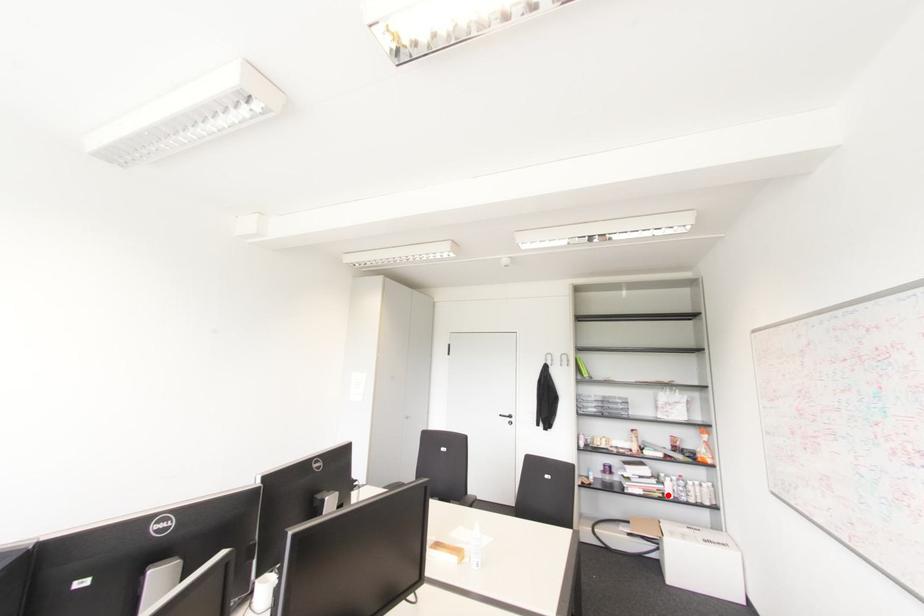
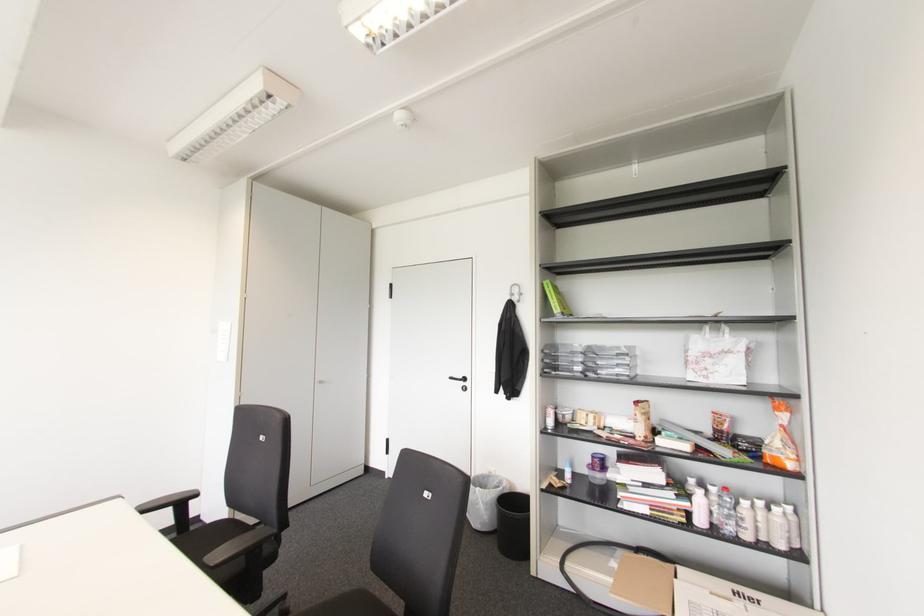
In the second image, find the point that corresponds to the highlighted location in the first image.

(699, 521)